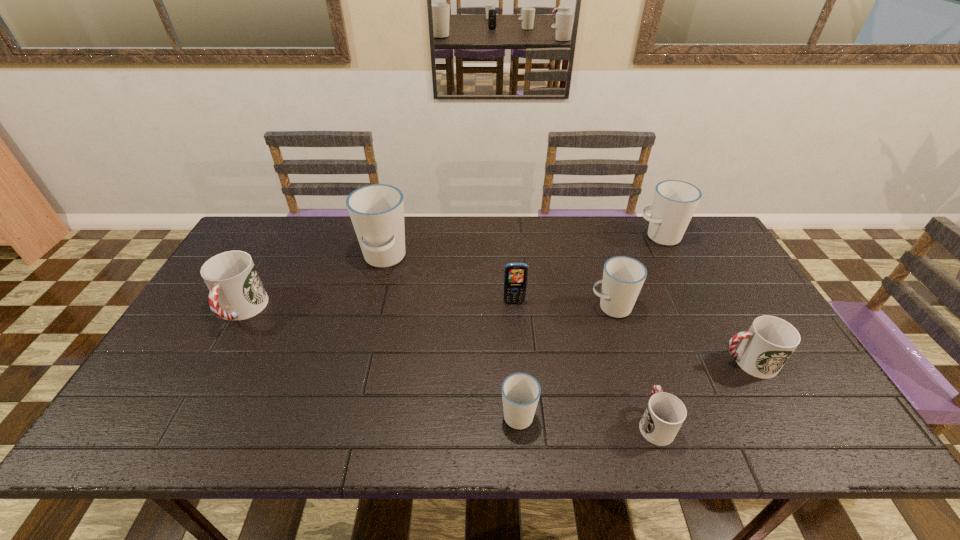
Locate an element on the screen. This screenshot has width=960, height=540. the rightmost red cup is located at coordinates (766, 346).

The width and height of the screenshot is (960, 540). In order to click on the second white cup from left to right in this screenshot , I will do `click(520, 392)`.

The width and height of the screenshot is (960, 540). Identify the location of the smallest white cup. (520, 392).

The width and height of the screenshot is (960, 540). Find the location of `the nearest red cup`. the nearest red cup is located at coordinates (665, 413).

Find the location of `the shortest cup`. the shortest cup is located at coordinates pyautogui.click(x=665, y=413).

Image resolution: width=960 pixels, height=540 pixels. Identify the location of vacant space located 0.120m with a handle on the side of the second cup from left to right. (372, 307).

Locate an element on the screen. This screenshot has height=540, width=960. free space located 0.250m with a handle on the side of the second biggest white cup is located at coordinates (563, 237).

This screenshot has width=960, height=540. In order to click on vacant space located 0.380m with a handle on the side of the second biggest white cup in this screenshot , I will do `click(525, 237)`.

At what (x,y) coordinates should I click in order to perform the action: click on vacant space located 0.230m with a handle on the side of the second biggest white cup. Please return your answer as a coordinate pair (x, y). Looking at the image, I should click on (569, 237).

Locate an element on the screen. vacant space located on the handle side of the biggest red cup is located at coordinates (174, 433).